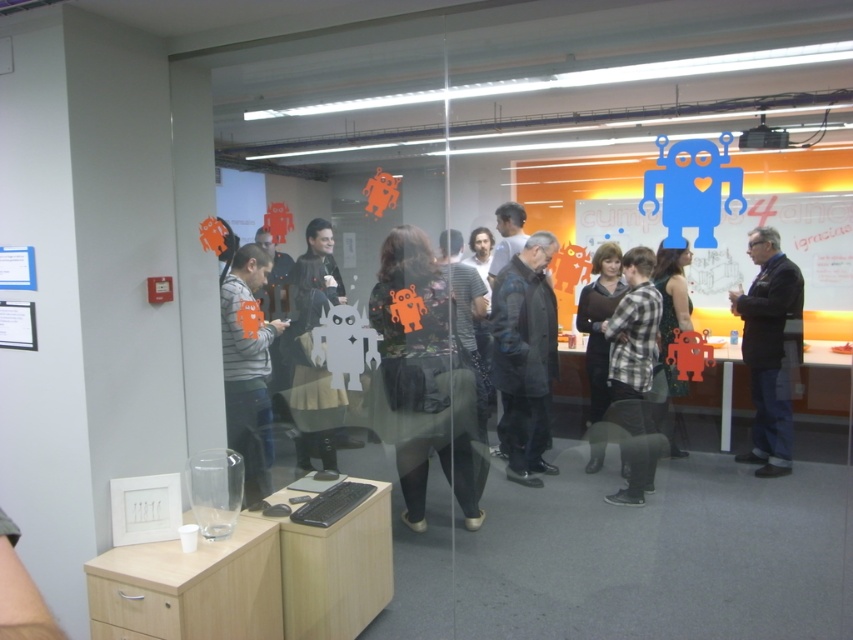
Question: Does dark blue jacket at right have a smaller size compared to plaid cotton shirt at center?

Choices:
 (A) no
 (B) yes

Answer: (A)

Question: Which point is farther to the camera?

Choices:
 (A) gray sweater at center
 (B) dark gray textured coat at center

Answer: (A)

Question: Is floral-patterned sweater at center wider than dark gray jacket at center?

Choices:
 (A) no
 (B) yes

Answer: (B)

Question: Among these points, which one is nearest to the camera?

Choices:
 (A) (227, 296)
 (B) (589, 369)

Answer: (A)

Question: Can you confirm if gray sweater at center is positioned above plaid fabric shirt at center?

Choices:
 (A) yes
 (B) no

Answer: (B)

Question: Among these objects, which one is nearest to the camera?

Choices:
 (A) black fabric jacket at center
 (B) blue paper robot at upper right

Answer: (A)